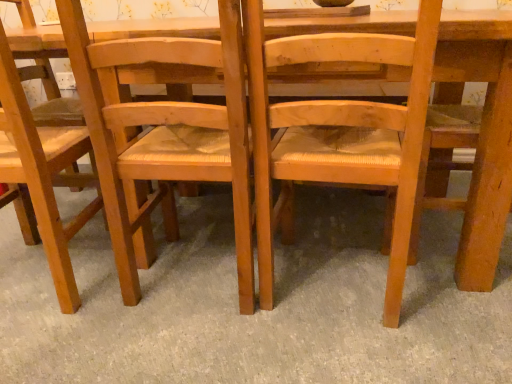
In order to click on free area in between wooden woven seat at center, the 2th chair when ordered from right to left, and natural wood chair at center, the third chair viewed from the left in this screenshot , I will do `click(288, 304)`.